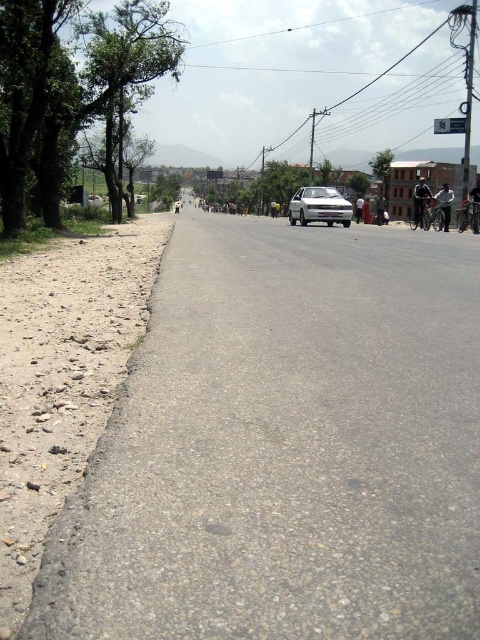
Can you confirm if white matte car at center is positioned above green leafy tree at right?

No.

Which is below, white matte car at center or green leafy tree at right?

white matte car at center

Does point (320, 196) come behind point (370, 166)?

No, (320, 196) is in front of (370, 166).

Image resolution: width=480 pixels, height=640 pixels. I want to click on white matte car at center, so [x=320, y=205].

Who is more forward, (19, 160) or (168, 195)?

Point (19, 160) is in front.

Between green leafy tree at left and green leafy tree at upper center, which one is positioned lower?

Positioned lower is green leafy tree at left.

Find the location of a particular element. This screenshot has height=640, width=480. green leafy tree at left is located at coordinates (72, 93).

Does white matte car at center have a smaller size compared to green leafy tree at upper center?

No.

Is point (312, 198) closer to viewer compared to point (157, 209)?

Yes, point (312, 198) is closer to viewer.

This screenshot has height=640, width=480. I want to click on white matte car at center, so click(320, 205).

Identify the location of white matte car at center. This screenshot has height=640, width=480. tap(320, 205).